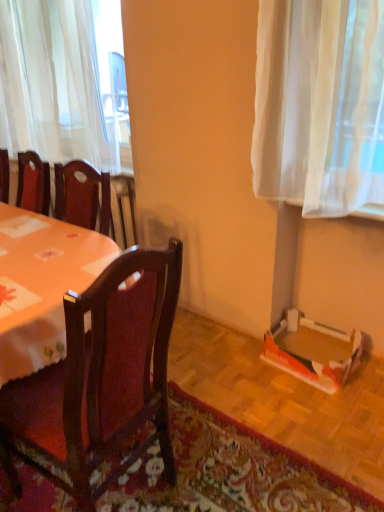
Question: In terms of height, does floral carpet at lower right look taller or shorter compared to dark wood chair at center?

Choices:
 (A) tall
 (B) short

Answer: (B)

Question: In the image, is floral carpet at lower right positioned in front of or behind dark wood chair at center?

Choices:
 (A) behind
 (B) front

Answer: (B)

Question: Which object is positioned closest to the orange cardboard box at lower right?

Choices:
 (A) dark wood chair at center
 (B) floral carpet at lower right
 (C) white sheer curtain at upper left
 (D) wooden table at left

Answer: (B)

Question: Which of these objects is positioned closest to the dark wood chair at center?

Choices:
 (A) orange cardboard box at lower right
 (B) floral carpet at lower right
 (C) wooden table at left
 (D) white sheer curtain at upper left

Answer: (B)